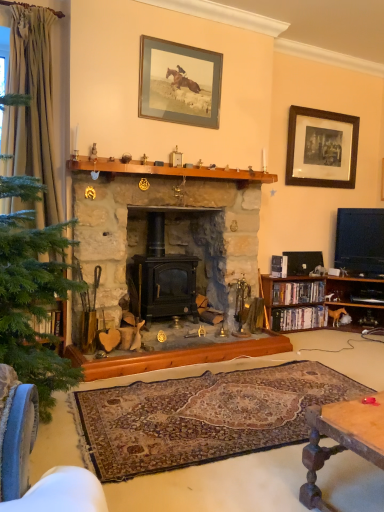
Where is `vacant space to the right of black plastic dvds at right, the first book in the bottom-to-top sequence`? This screenshot has height=512, width=384. vacant space to the right of black plastic dvds at right, the first book in the bottom-to-top sequence is located at coordinates (346, 338).